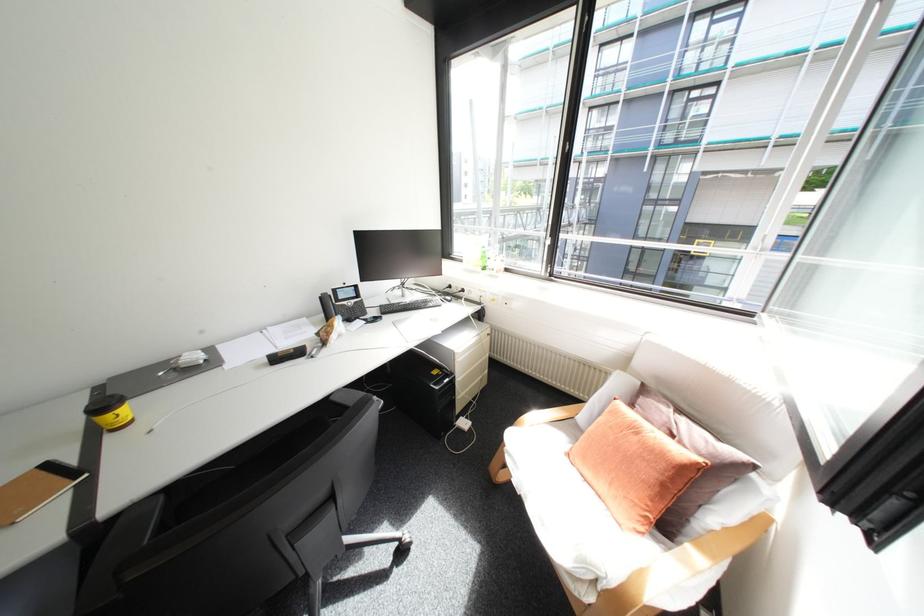
Find where to clos the black glasses case. Please return your answer as a coordinate pair (x, y).

(286, 354)